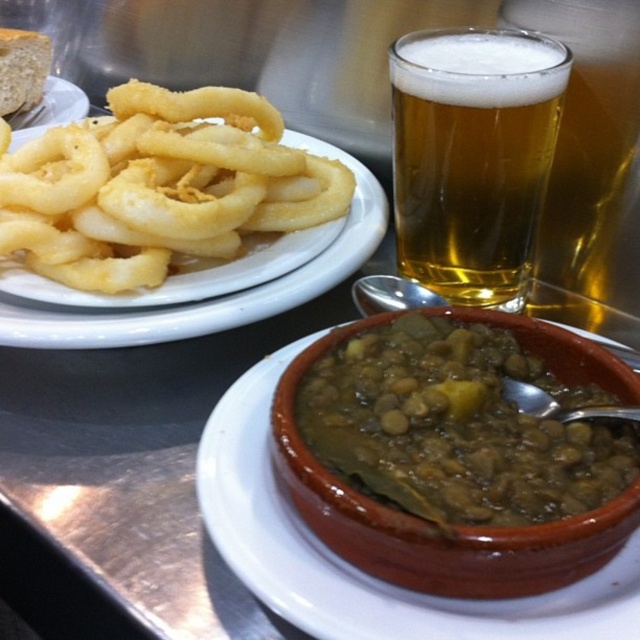
In the scene shown: What is located at the coordinates point (x=472, y=156)?

At point (x=472, y=156) lies golden amber liquid at upper right.

You are a food critic analyzing the arrangement of dishes in this meal. Which dish is positioned lower in the image, the green matte stew at center or the golden amber liquid at upper right?

The green matte stew at center is positioned below the golden amber liquid at upper right, so it is lower in the image.